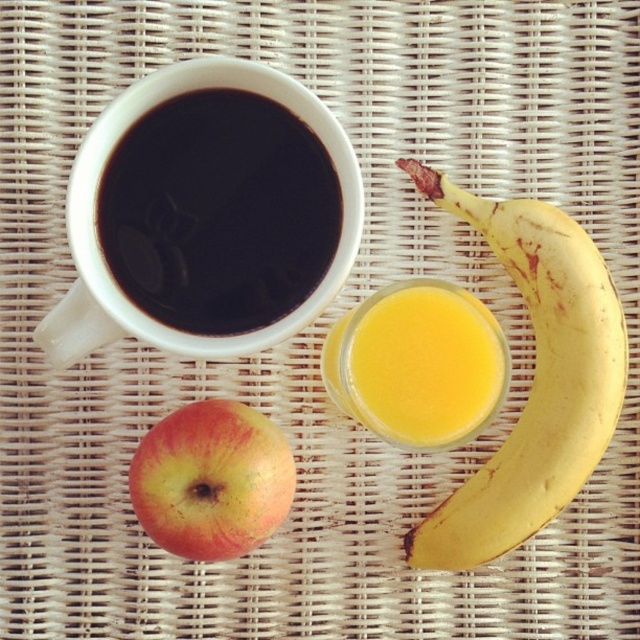
Question: Which point is closer to the camera?

Choices:
 (A) translucent yellow liquid at center
 (B) black matte cup at upper left
 (C) yellow matte banana at lower right

Answer: (B)

Question: Which is farther from the black matte cup at upper left?

Choices:
 (A) red matte apple at lower left
 (B) translucent yellow liquid at center
 (C) yellow matte banana at lower right

Answer: (C)

Question: Is the position of yellow matte banana at lower right more distant than that of red matte apple at lower left?

Choices:
 (A) no
 (B) yes

Answer: (B)

Question: Is yellow matte banana at lower right bigger than translucent yellow liquid at center?

Choices:
 (A) yes
 (B) no

Answer: (A)

Question: Can you confirm if black matte cup at upper left is positioned to the right of red matte apple at lower left?

Choices:
 (A) no
 (B) yes

Answer: (B)

Question: Which object is closer to the camera taking this photo?

Choices:
 (A) yellow matte banana at lower right
 (B) red matte apple at lower left

Answer: (B)